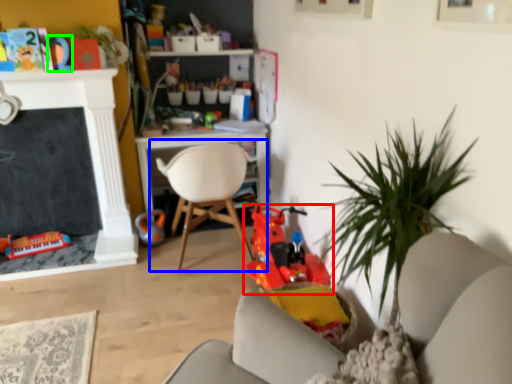
Question: Estimate the real-world distances between objects in this image. Which object is closer to toy (highlighted by a red box), chair (highlighted by a blue box) or toy (highlighted by a green box)?

Choices:
 (A) chair
 (B) toy

Answer: (A)